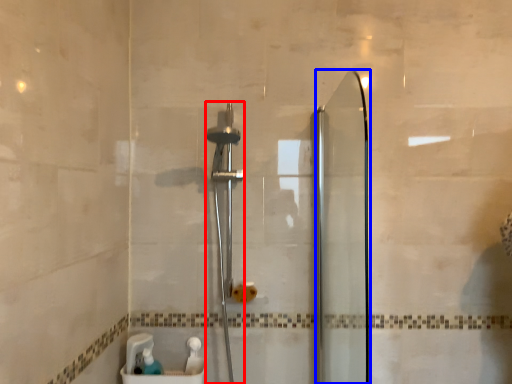
Question: Among these objects, which one is nearest to the camera, shower (highlighted by a red box) or screen door (highlighted by a blue box)?

Choices:
 (A) shower
 (B) screen door

Answer: (B)